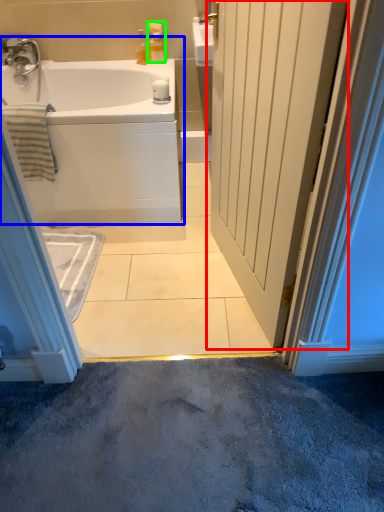
Question: Based on their relative distances, which object is farther from door (highlighted by a red box)? Choose from bathtub (highlighted by a blue box) and toiletry (highlighted by a green box).

Choices:
 (A) bathtub
 (B) toiletry

Answer: (B)